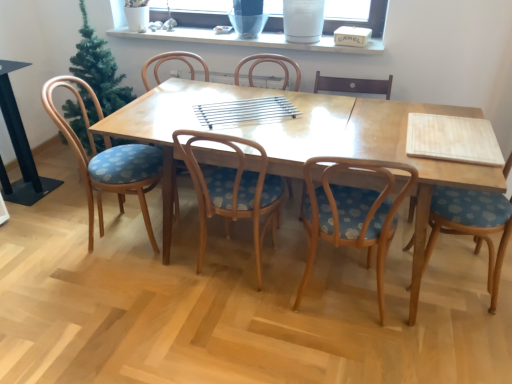
Locate an element on the screen. This screenshot has width=512, height=384. free space on the front side of blue fabric chair at right, the 6th chair in the left-to-right sequence is located at coordinates (458, 337).